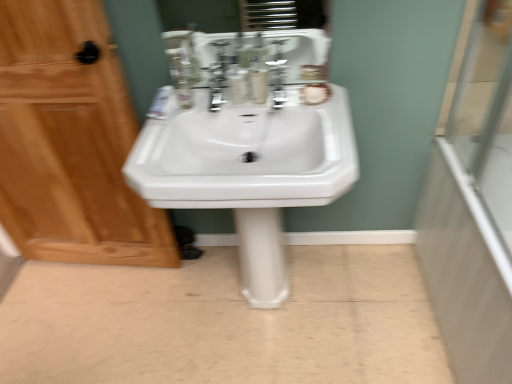
Locate an element on the screen. unoccupied region to the right of translucent plastic mouthwash at center, which is the 1th mouthwash from right to left is located at coordinates (310, 98).